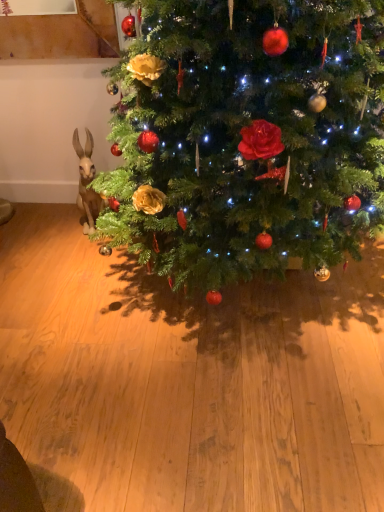
Where is `free location in front of green matte christmas tree at center`? This screenshot has height=512, width=384. free location in front of green matte christmas tree at center is located at coordinates (220, 423).